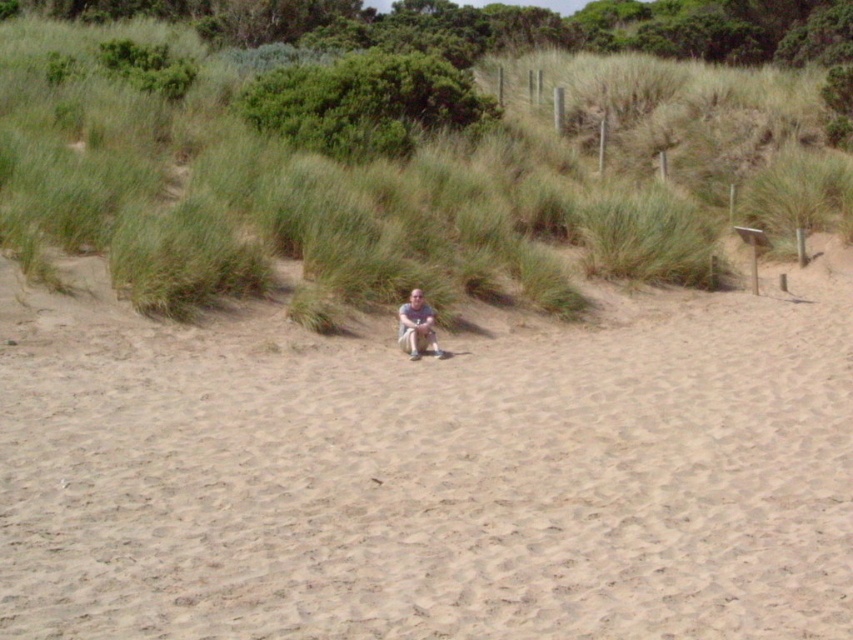
Which is in front, point (837, 600) or point (418, 317)?

Point (837, 600) is in front.

Which of these two, beige sandy beach at center or light brown fabric pants at center, stands taller?

beige sandy beach at center is taller.

Is point (556, 324) positioned in front of point (434, 340)?

No, (556, 324) is behind (434, 340).

Where is `beige sandy beach at center`? beige sandy beach at center is located at coordinates (431, 470).